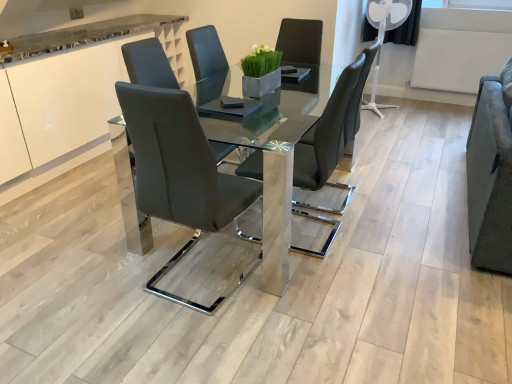
Question: Does matte black chair at center, the 1th chair positioned from the left, have a greater height compared to velvet grey armchair at right?

Choices:
 (A) yes
 (B) no

Answer: (A)

Question: Considering the relative positions of matte black chair at center, the 2th chair viewed from the right, and velvet grey armchair at right in the image provided, is matte black chair at center, the 2th chair viewed from the right, to the left of velvet grey armchair at right from the viewer's perspective?

Choices:
 (A) yes
 (B) no

Answer: (A)

Question: Does matte black chair at center, the 1th chair positioned from the left, turn towards velvet grey armchair at right?

Choices:
 (A) yes
 (B) no

Answer: (B)

Question: Is matte black chair at center, the 2th chair viewed from the right, positioned in front of velvet grey armchair at right?

Choices:
 (A) yes
 (B) no

Answer: (A)

Question: Is matte black chair at center, the 1th chair positioned from the left, bigger than velvet grey armchair at right?

Choices:
 (A) yes
 (B) no

Answer: (B)

Question: Would you say velvet grey armchair at right is inside or outside white glossy cabinet at upper left?

Choices:
 (A) outside
 (B) inside

Answer: (A)

Question: Is point (468, 152) closer or farther from the camera than point (83, 56)?

Choices:
 (A) farther
 (B) closer

Answer: (B)

Question: From the image's perspective, is velvet grey armchair at right located above or below white glossy cabinet at upper left?

Choices:
 (A) below
 (B) above

Answer: (A)

Question: Based on their positions, is velvet grey armchair at right located to the left or right of white glossy cabinet at upper left?

Choices:
 (A) left
 (B) right

Answer: (B)

Question: From a real-world perspective, is velvet grey armchair at right physically located above or below matte black chair at center, which is the 2th chair from left to right?

Choices:
 (A) above
 (B) below

Answer: (B)

Question: Considering the positions of velvet grey armchair at right and matte black chair at center, which is the 2th chair from left to right, in the image, is velvet grey armchair at right taller or shorter than matte black chair at center, which is the 2th chair from left to right,?

Choices:
 (A) tall
 (B) short

Answer: (B)

Question: In the image, is velvet grey armchair at right positioned in front of or behind matte black chair at center, placed as the 1th chair when sorted from right to left?

Choices:
 (A) behind
 (B) front

Answer: (B)

Question: Is point (487, 125) positioned closer to the camera than point (320, 150)?

Choices:
 (A) farther
 (B) closer

Answer: (A)

Question: Does point (74, 124) appear closer or farther from the camera than point (301, 140)?

Choices:
 (A) farther
 (B) closer

Answer: (A)

Question: Considering the relative positions of white glossy cabinet at upper left and matte black chair at center, which is the 2th chair from left to right, in the image provided, is white glossy cabinet at upper left to the left or to the right of matte black chair at center, which is the 2th chair from left to right,?

Choices:
 (A) left
 (B) right

Answer: (A)